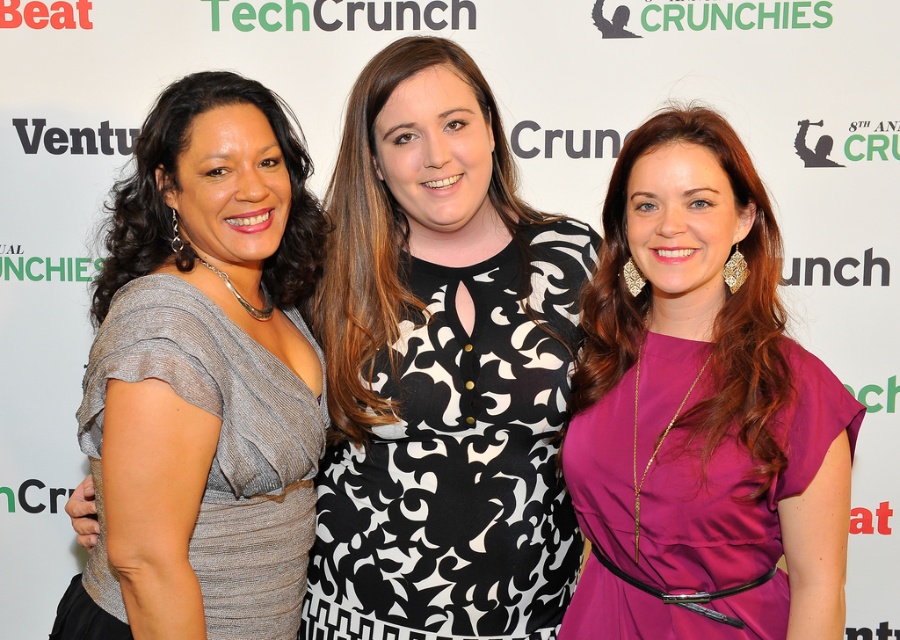
You are taking a photo of the three women standing against the TechCrunch backdrop. You want to focus on the point at point (501, 445) and the point at point (788, 612). Which point is closer to your camera?

Point (501, 445) is further to the camera than point (788, 612), so the point at point (501, 445) is closer to the camera.